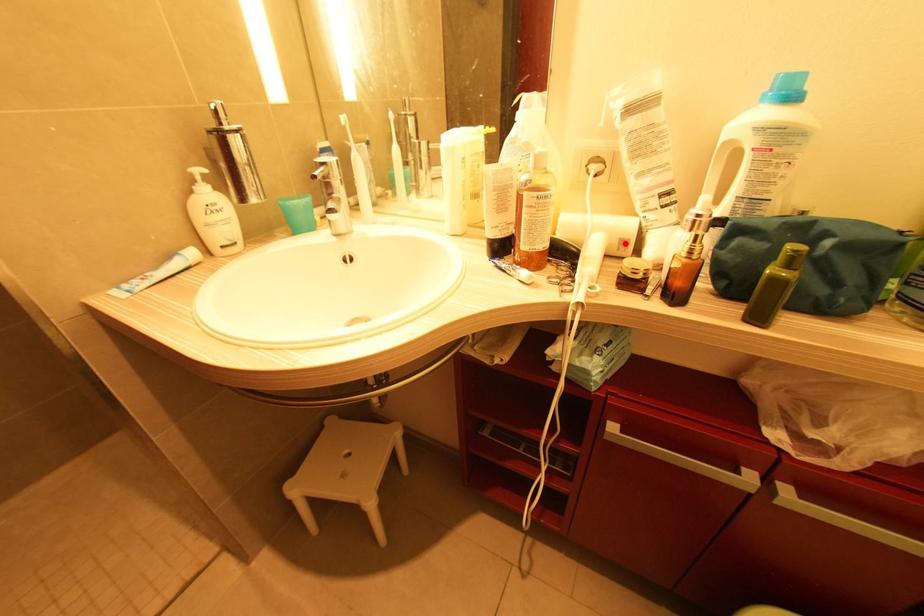
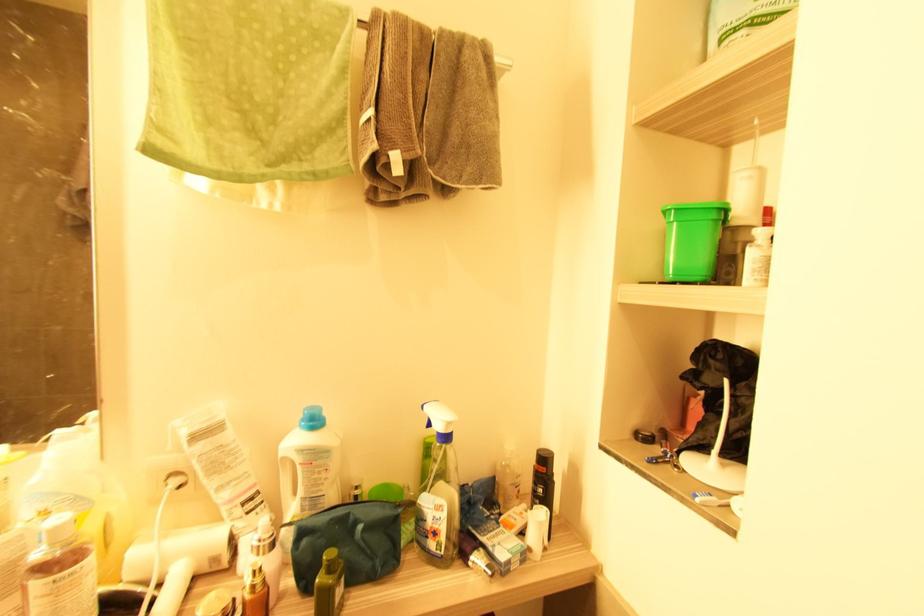
The point at the highlighted location is marked in the first image. Where is the corresponding point in the second image?

(216, 561)